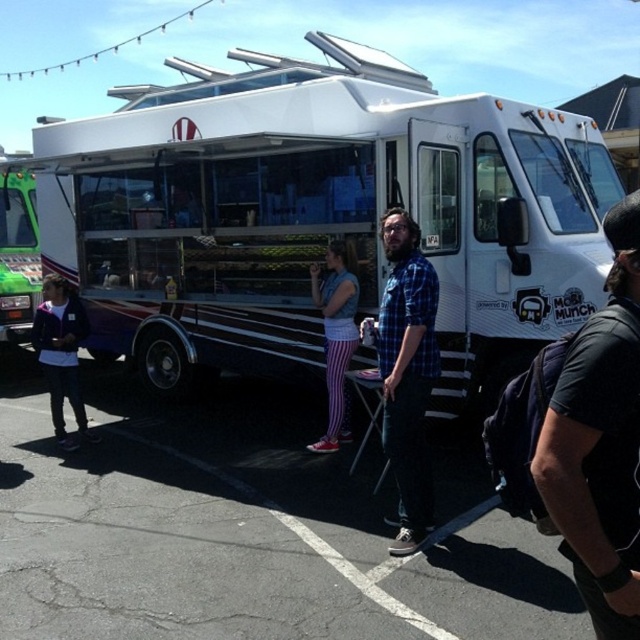
You are a customer waiting in line at the Mobi Munch food truck. You notice a blue plaid shirt at center and a white glossy food truck at center. Which object is closer to you?

The white glossy food truck at center is closer to you because the blue plaid shirt at center is behind it.

Based on the photo, you are standing in front of the Mobi Munch food truck and see a point marked at coordinates (61, 353). According to the scene description, what object or part of the scene is located at this point?

The point at coordinates (61, 353) is on the matte purple jacket at left.